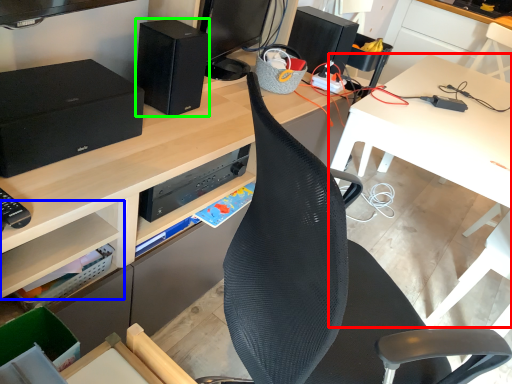
Question: Based on their relative distances, which object is farther from table (highlighted by a red box)? Choose from shelf (highlighted by a blue box) and speaker (highlighted by a green box).

Choices:
 (A) shelf
 (B) speaker

Answer: (A)